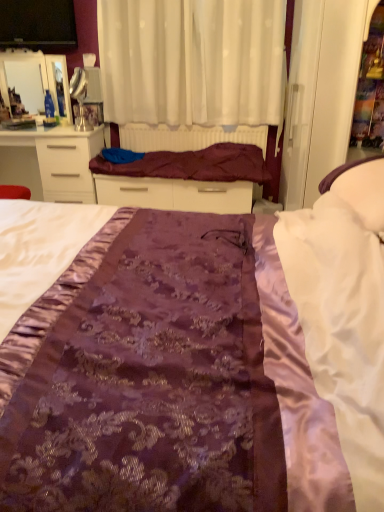
Question: Is matte black tv at upper left with purple satin bed frame at center?

Choices:
 (A) no
 (B) yes

Answer: (A)

Question: Considering the relative positions of matte black tv at upper left and purple satin bed frame at center in the image provided, is matte black tv at upper left to the left of purple satin bed frame at center from the viewer's perspective?

Choices:
 (A) yes
 (B) no

Answer: (A)

Question: Can you confirm if matte black tv at upper left is smaller than purple satin bed frame at center?

Choices:
 (A) yes
 (B) no

Answer: (A)

Question: Is matte black tv at upper left at the right side of purple satin bed frame at center?

Choices:
 (A) no
 (B) yes

Answer: (A)

Question: Is purple satin bed frame at center located within matte black tv at upper left?

Choices:
 (A) yes
 (B) no

Answer: (B)

Question: In terms of width, does white sheer curtain at upper center look wider or thinner when compared to matte black tv at upper left?

Choices:
 (A) wide
 (B) thin

Answer: (A)

Question: From a real-world perspective, is white sheer curtain at upper center positioned above or below matte black tv at upper left?

Choices:
 (A) above
 (B) below

Answer: (B)

Question: From the image's perspective, is white sheer curtain at upper center positioned above or below matte black tv at upper left?

Choices:
 (A) below
 (B) above

Answer: (A)

Question: Looking at the image, does white sheer curtain at upper center seem bigger or smaller compared to matte black tv at upper left?

Choices:
 (A) small
 (B) big

Answer: (B)

Question: Would you say white sheer curtain at upper center is to the left or to the right of maroon satin blanket at center in the picture?

Choices:
 (A) left
 (B) right

Answer: (B)

Question: Considering the positions of white sheer curtain at upper center and maroon satin blanket at center in the image, is white sheer curtain at upper center taller or shorter than maroon satin blanket at center?

Choices:
 (A) short
 (B) tall

Answer: (B)

Question: Does point (203, 100) appear closer or farther from the camera than point (160, 168)?

Choices:
 (A) closer
 (B) farther

Answer: (B)

Question: Based on their sizes in the image, would you say white sheer curtain at upper center is bigger or smaller than maroon satin blanket at center?

Choices:
 (A) small
 (B) big

Answer: (B)

Question: In terms of height, does purple satin bed at center look taller or shorter compared to matte black tv at upper left?

Choices:
 (A) short
 (B) tall

Answer: (B)

Question: Is purple satin bed at center in front of or behind matte black tv at upper left in the image?

Choices:
 (A) behind
 (B) front

Answer: (B)